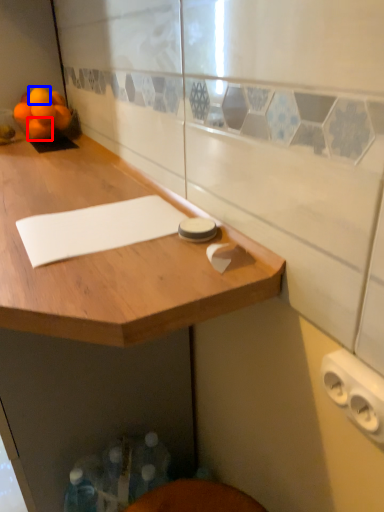
Question: Which point is closer to the camera, orange (highlighted by a red box) or orange (highlighted by a blue box)?

Choices:
 (A) orange
 (B) orange

Answer: (B)